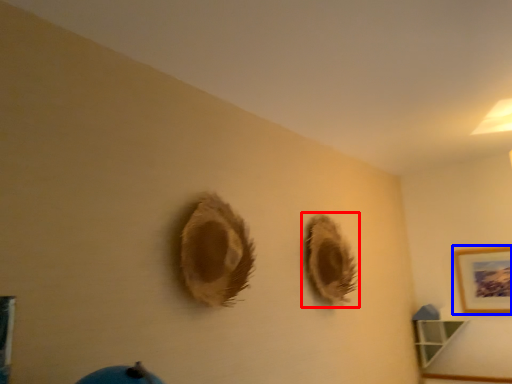
Question: Which object appears farthest to the camera in this image, hole (highlighted by a red box) or picture frame (highlighted by a blue box)?

Choices:
 (A) hole
 (B) picture frame

Answer: (B)